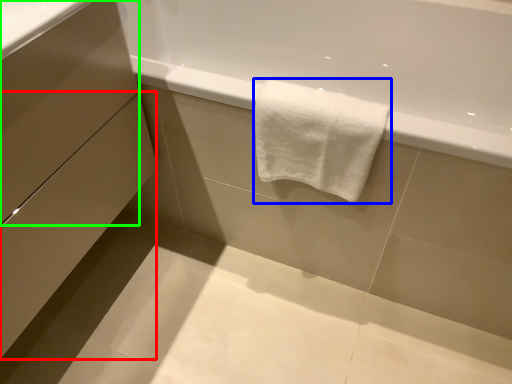
Question: Which object is the farthest from drawer (highlighted by a red box)? Choose among these: towel (highlighted by a blue box) or drawer (highlighted by a green box).

Choices:
 (A) towel
 (B) drawer

Answer: (A)